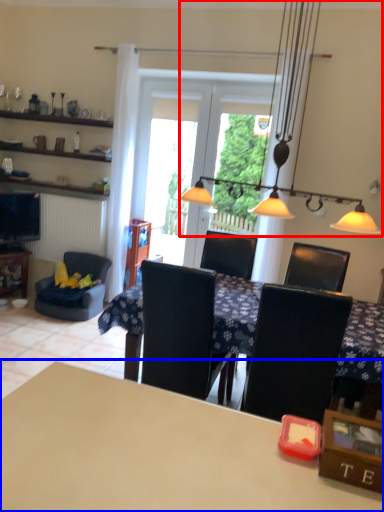
Question: Among these objects, which one is nearest to the camera, light fixture (highlighted by a red box) or table (highlighted by a blue box)?

Choices:
 (A) light fixture
 (B) table

Answer: (B)